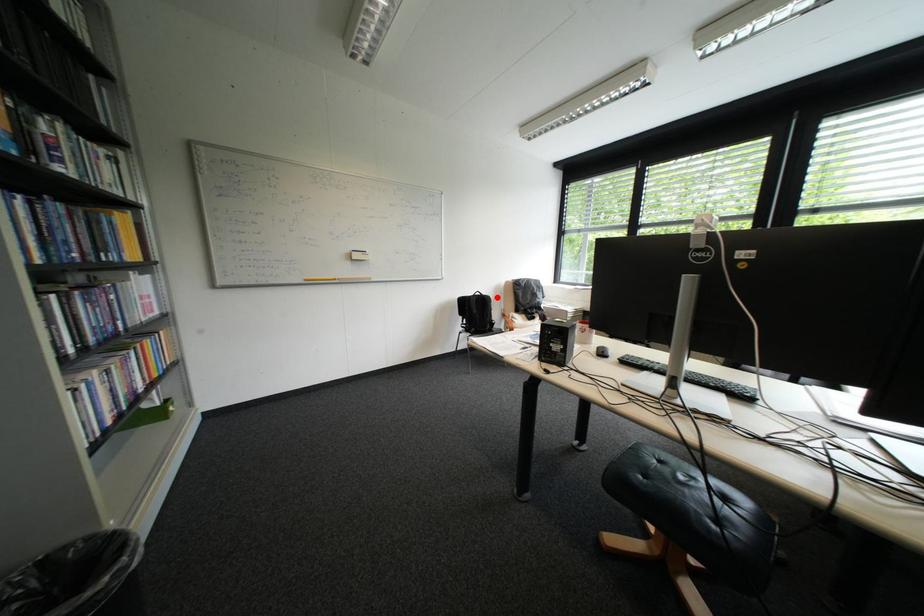
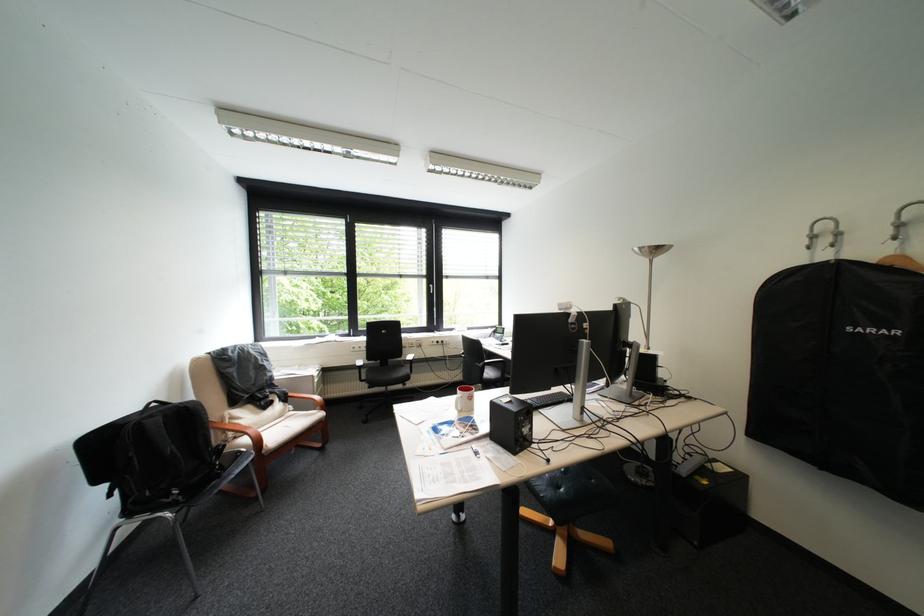
Where in the second image is the point corresponding to the highlighted location from the first image?

(199, 407)